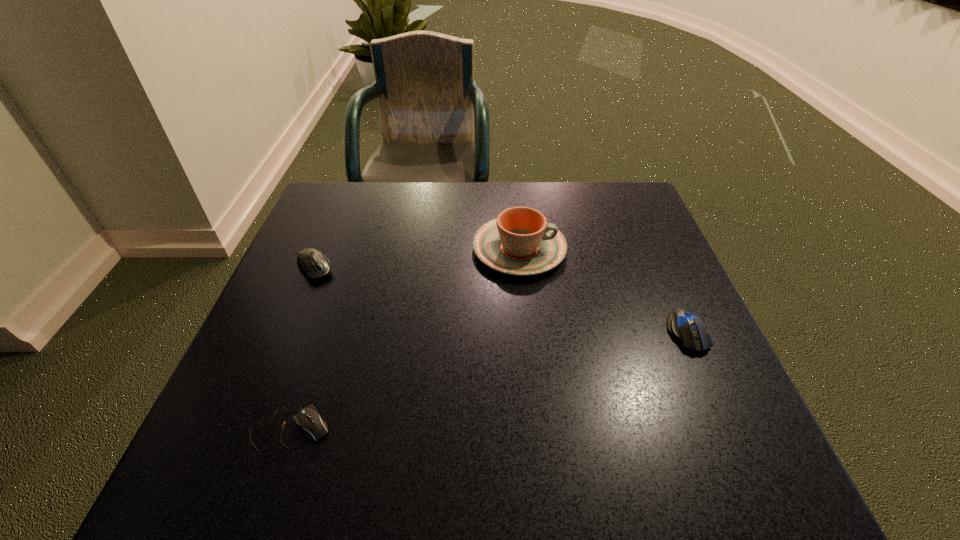
At what (x,y) coordinates should I click in order to perform the action: click on free space at the near left corner of the desktop. Please return your answer as a coordinate pair (x, y). Looking at the image, I should click on (227, 446).

This screenshot has width=960, height=540. In order to click on vacant area at the far right corner of the desktop in this screenshot , I will do `click(642, 218)`.

Find the location of a particular element. This screenshot has height=540, width=960. free space between the nearest computer mouse and the second nearest object is located at coordinates (489, 380).

Find the location of a particular element. Image resolution: width=960 pixels, height=540 pixels. free space between the second tallest computer mouse and the shortest computer mouse is located at coordinates (489, 380).

The height and width of the screenshot is (540, 960). I want to click on free space between the second nearest object and the shortest object, so click(489, 380).

This screenshot has height=540, width=960. Identify the location of vacant area that lies between the third tallest object and the shortest computer mouse. (489, 380).

Find the location of `vacant space that's between the second nearest computer mouse and the chinaware`. vacant space that's between the second nearest computer mouse and the chinaware is located at coordinates (603, 291).

This screenshot has height=540, width=960. Identify the location of vacant region between the second shortest object and the tallest computer mouse. click(501, 301).

Find the location of a particular element. free space between the second farthest computer mouse and the second object from right to left is located at coordinates (603, 291).

Find the location of a particular element. The width and height of the screenshot is (960, 540). vacant region between the second shortest computer mouse and the third object from left to right is located at coordinates (603, 291).